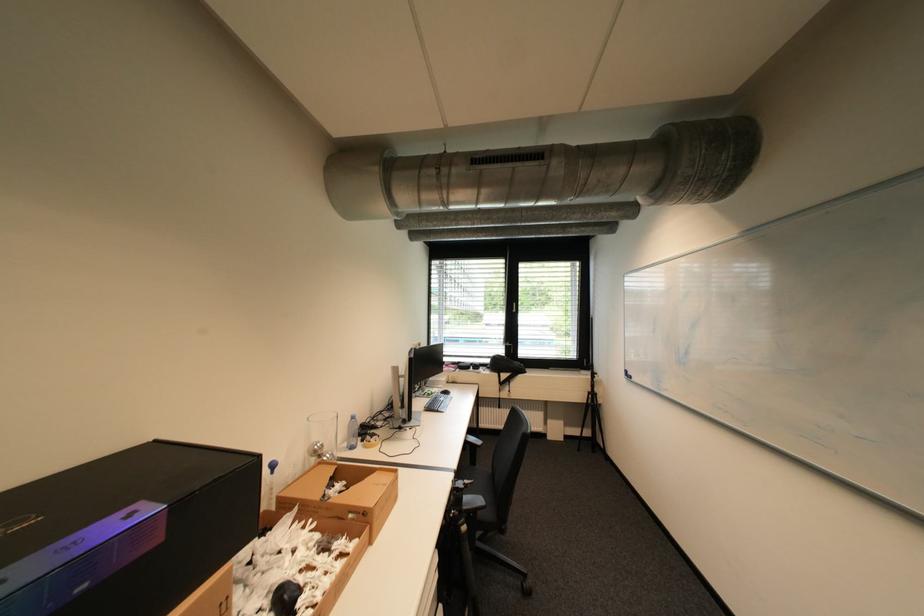
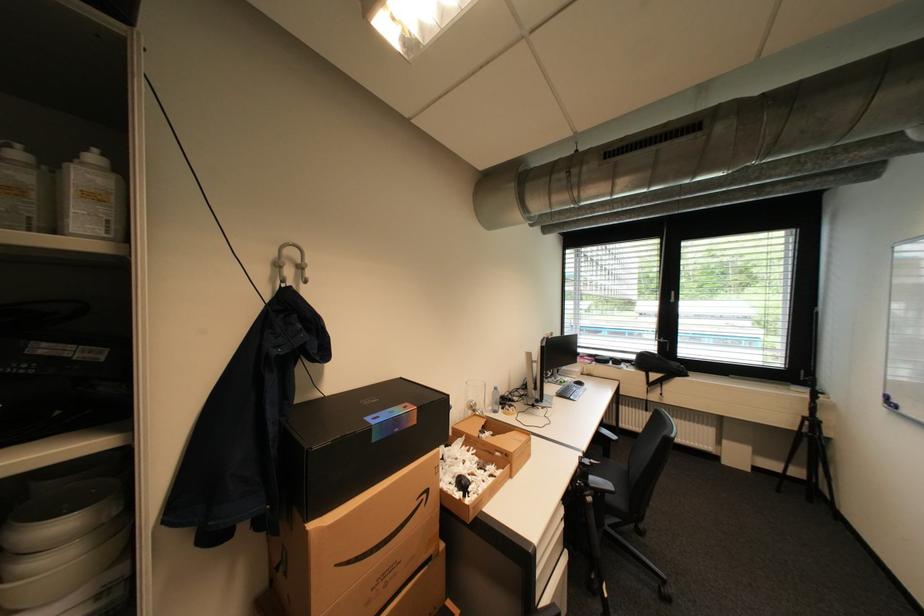
In the second image, find the point that corresponds to (466,514) in the first image.

(591, 485)